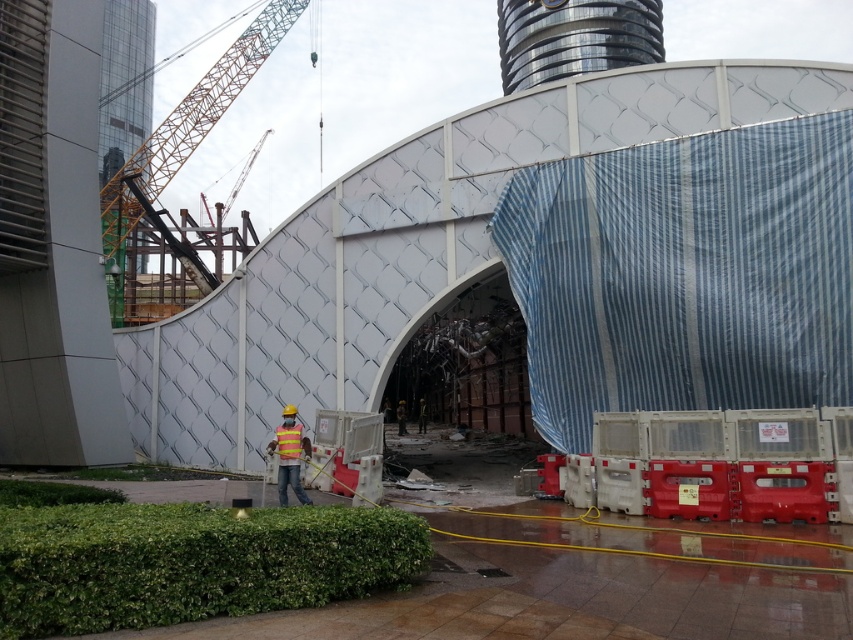
This screenshot has height=640, width=853. Identify the location of yellow reflective vest at center. (289, 456).

Can you confirm if yellow reflective vest at center is positioned to the right of yellow reflective safety vest at center?

Incorrect, yellow reflective vest at center is not on the right side of yellow reflective safety vest at center.

Is point (303, 448) more distant than point (286, 422)?

Yes.

Where is `yellow reflective vest at center`? The image size is (853, 640). yellow reflective vest at center is located at coordinates (289, 456).